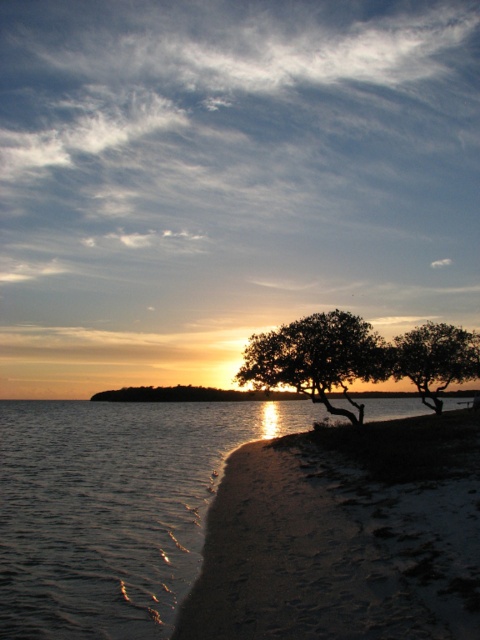
You are standing on the beach and want to take a photo of both the silhouette wood tree at center and the green matte tree at lower right. Which tree should you zoom in on first to ensure both are in the frame?

The silhouette wood tree at center is shorter than the green matte tree at lower right, so you should zoom in on the green matte tree at lower right first to ensure both are in the frame.

You are standing on the sandy beach at lower right and want to see the horizon line. Since the green matte tree at lower right is blocking your view, can you see the horizon line over the tree?

The sandy beach at lower right is shorter than the green matte tree at lower right. Since the tree is taller than the beach area, the tree would block your view of the horizon line.

You are standing on the sandy beach at lower right and want to take a photo of the silhouette wood tree at center. Which direction should you face to ensure the tree is in the background of your photo?

The sandy beach at lower right is located below the silhouette wood tree at center, so you should face upwards to have the silhouette wood tree at center in the background of your photo.